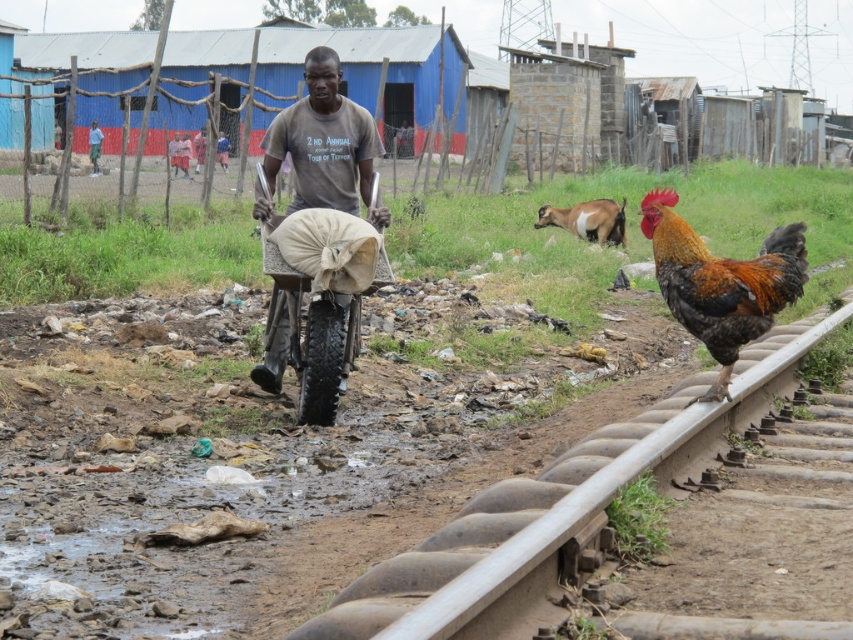
You are standing at the center of the image and want to reach the brown metal rail at right. Which direction should you move to get there?

The brown metal rail at right is located at point 0.789 on the x and 0.649 on the y, so you should move to the right and slightly forward to reach it.

You are standing at the point labeled point [676,314] and want to walk to the point labeled point [595,228]. Which direction should you face to move towards your destination?

You should face away from the viewer because point [595,228] is farther away than point [676,314].

You are a traveler who wants to take a photo of the multicolored feathered rooster at right and the brown cotton shirt at center. Since the rooster is on the railway track, you need to decide whether to stand on the path or the track to capture both subjects in one frame. Based on their positions, which location should you choose?

You should stand on the path because the multicolored feathered rooster at right is to the right of the brown cotton shirt at center, meaning they are aligned along the same axis. By standing on the path, you can position yourself to include both subjects in your frame without needing to step onto the railway track.